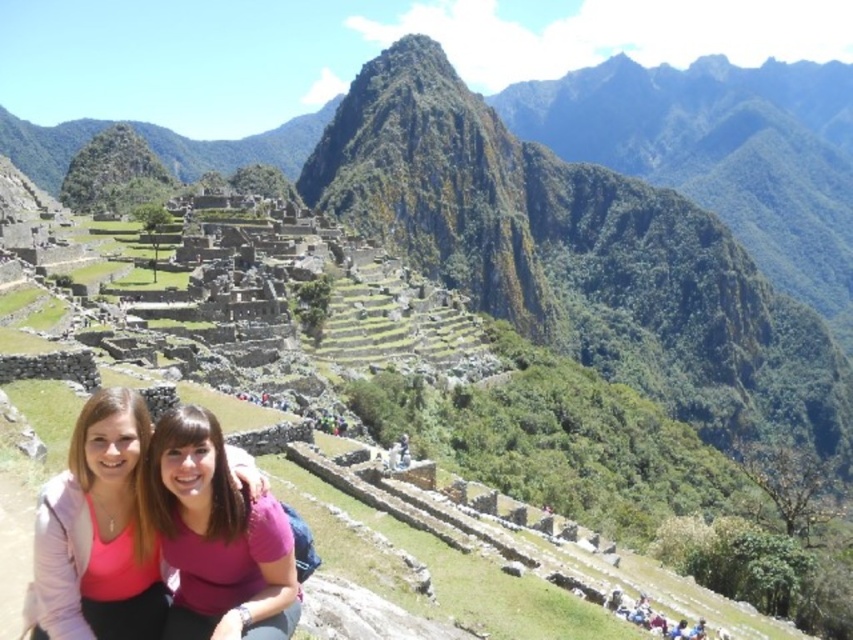
What do you see at coordinates (97, 531) in the screenshot? I see `pink fabric at center` at bounding box center [97, 531].

Based on the photo, does pink fabric at center have a lesser width compared to pink matte shirt at center?

Yes.

At what (x,y) coordinates should I click in order to perform the action: click on pink fabric at center. Please return your answer as a coordinate pair (x, y). This screenshot has height=640, width=853. Looking at the image, I should click on (97, 531).

Where is `pink fabric at center`? pink fabric at center is located at coordinates (97, 531).